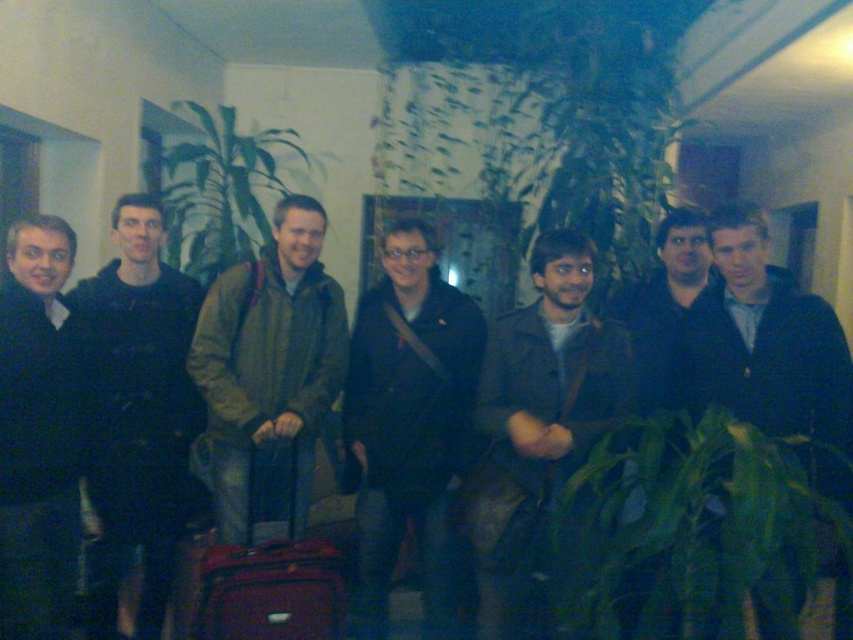
You are trying to decide which jacket to take from the group. Both the black matte jacket at center and the brown leather jacket at center are available. Based on their sizes, which one is narrower?

The black matte jacket at center is narrower than the brown leather jacket at center, so you should choose the black matte jacket at center.

You are a photographer trying to capture a group photo of the seven individuals in the scene. You notice the green matte jacket at center and the black matte sweater at left. Based on their positions and the lighting, which clothing item might block the light more when taking the photo?

The green matte jacket at center might block more light because it is wider than the black matte sweater at left, potentially casting a larger shadow in the dimly lit environment.